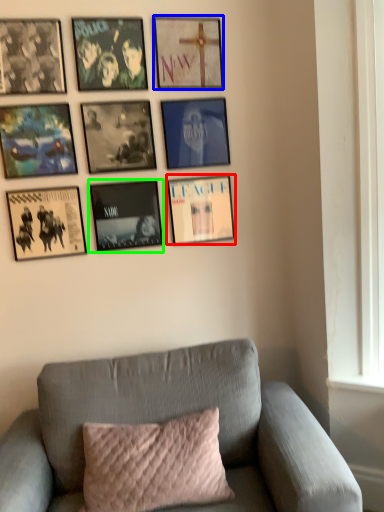
Question: Which object is positioned farthest from picture frame (highlighted by a red box)? Select from picture frame (highlighted by a blue box) and picture frame (highlighted by a green box).

Choices:
 (A) picture frame
 (B) picture frame

Answer: (A)